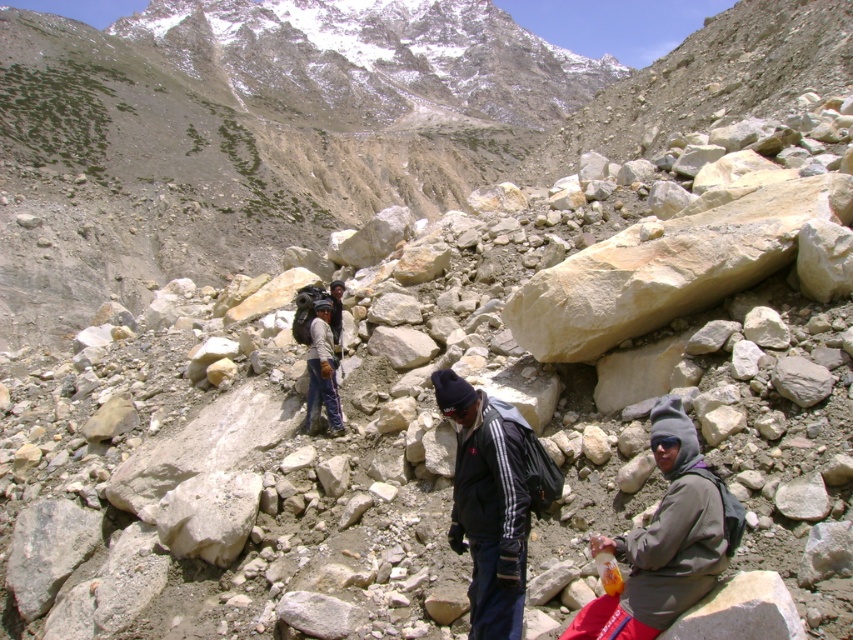
Does gray fleece jacket at lower right have a smaller size compared to dark gray fleece jacket at center?

Indeed, gray fleece jacket at lower right has a smaller size compared to dark gray fleece jacket at center.

Which is in front, point (666, 396) or point (486, 580)?

Point (486, 580) is in front.

I want to click on gray fleece jacket at lower right, so click(x=666, y=540).